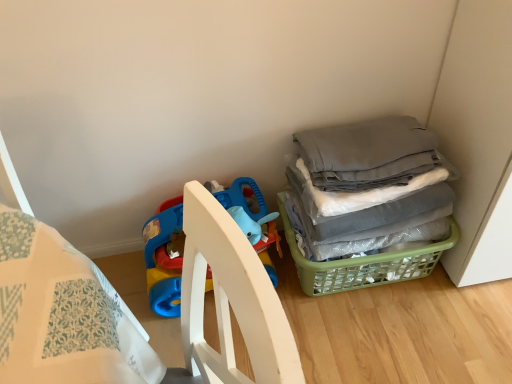
Question: Should I look upward or downward to see plastic blue playpen at lower left?

Choices:
 (A) up
 (B) down

Answer: (B)

Question: Does gray fabric at right appear on the right side of green plastic basket at lower right?

Choices:
 (A) no
 (B) yes

Answer: (B)

Question: From a real-world perspective, is gray fabric at right under green plastic basket at lower right?

Choices:
 (A) yes
 (B) no

Answer: (B)

Question: Would you say gray fabric at right is a long distance from green plastic basket at lower right?

Choices:
 (A) no
 (B) yes

Answer: (A)

Question: From the image's perspective, is gray fabric at right over green plastic basket at lower right?

Choices:
 (A) yes
 (B) no

Answer: (A)

Question: Considering the relative sizes of gray fabric at right and green plastic basket at lower right in the image provided, is gray fabric at right taller than green plastic basket at lower right?

Choices:
 (A) yes
 (B) no

Answer: (A)

Question: Can you confirm if gray fabric at right is thinner than green plastic basket at lower right?

Choices:
 (A) no
 (B) yes

Answer: (B)

Question: Is plastic blue playpen at lower left oriented away from gray fabric at right?

Choices:
 (A) no
 (B) yes

Answer: (A)

Question: From a real-world perspective, is plastic blue playpen at lower left positioned under gray fabric at right based on gravity?

Choices:
 (A) yes
 (B) no

Answer: (A)

Question: Is plastic blue playpen at lower left oriented towards gray fabric at right?

Choices:
 (A) no
 (B) yes

Answer: (A)

Question: Could gray fabric at right be considered to be inside plastic blue playpen at lower left?

Choices:
 (A) yes
 (B) no

Answer: (B)

Question: From the image's perspective, is plastic blue playpen at lower left located above gray fabric at right?

Choices:
 (A) yes
 (B) no

Answer: (B)

Question: Considering the relative positions of plastic blue playpen at lower left and gray fabric at right in the image provided, is plastic blue playpen at lower left behind gray fabric at right?

Choices:
 (A) no
 (B) yes

Answer: (B)

Question: Is gray fabric at right taller than plastic blue playpen at lower left?

Choices:
 (A) yes
 (B) no

Answer: (A)